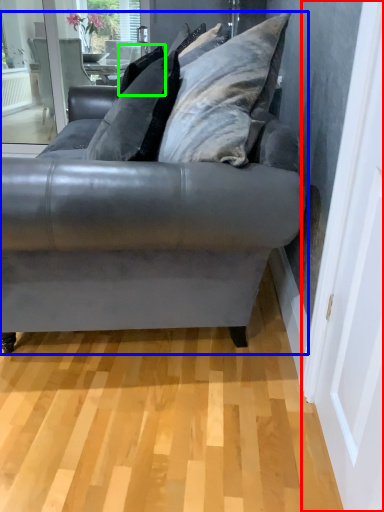
Question: Based on their relative distances, which object is farther from screen door (highlighted by a red box)? Choose from studio couch (highlighted by a blue box) and pillow (highlighted by a green box).

Choices:
 (A) studio couch
 (B) pillow

Answer: (B)